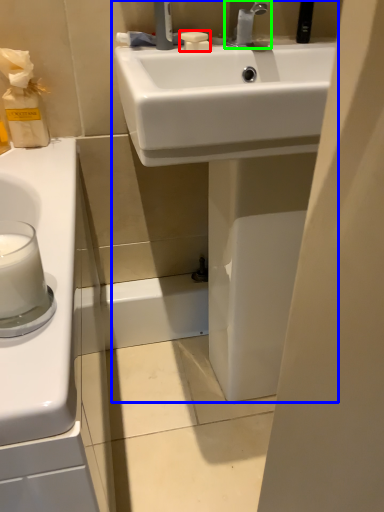
Question: Which is farther away from soap (highlighted by a red box)? sink (highlighted by a blue box) or tap (highlighted by a green box)?

Choices:
 (A) sink
 (B) tap

Answer: (A)